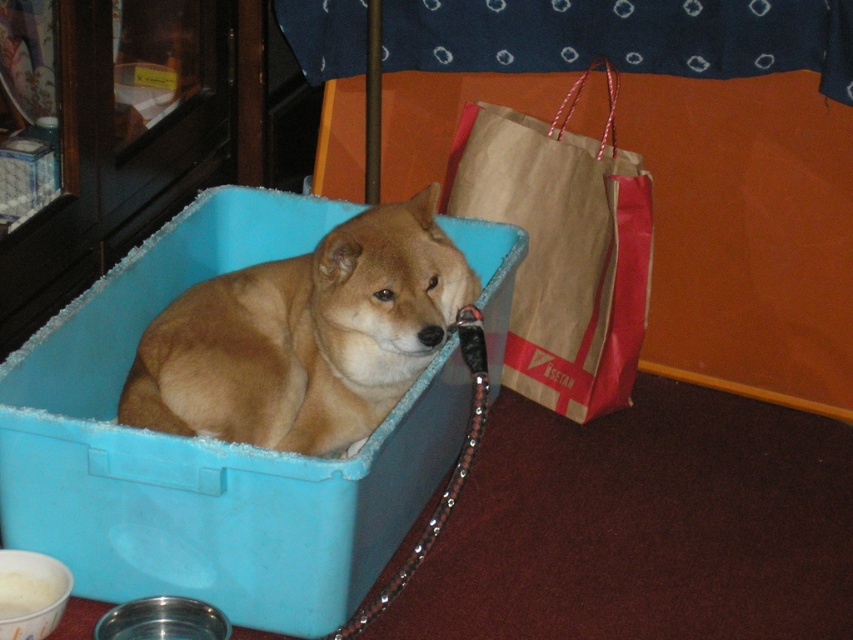
Question: In this image, where is brown fur dog at center located relative to brown paper bag at right?

Choices:
 (A) above
 (B) below

Answer: (B)

Question: Estimate the real-world distances between objects in this image. Which object is farther from the brown paper bag at right?

Choices:
 (A) blue plastic box at center
 (B) brown fur dog at center

Answer: (B)

Question: Is blue plastic box at center to the right of brown paper bag at right from the viewer's perspective?

Choices:
 (A) yes
 (B) no

Answer: (B)

Question: Which point is farther to the camera?

Choices:
 (A) brown paper bag at right
 (B) blue plastic box at center
 (C) brown fur dog at center

Answer: (A)

Question: Does blue plastic box at center come behind brown paper bag at right?

Choices:
 (A) yes
 (B) no

Answer: (B)

Question: Estimate the real-world distances between objects in this image. Which object is farther from the brown paper bag at right?

Choices:
 (A) blue plastic box at center
 (B) brown fur dog at center

Answer: (B)